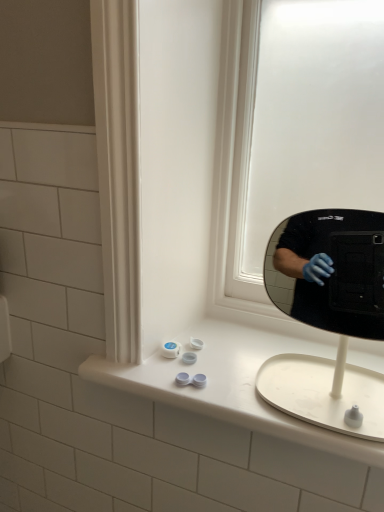
Locate an element on the screen. The image size is (384, 512). white matte counter top at center is located at coordinates (233, 381).

This screenshot has width=384, height=512. Describe the element at coordinates (233, 381) in the screenshot. I see `white matte counter top at center` at that location.

Identify the location of white matte counter top at center. (233, 381).